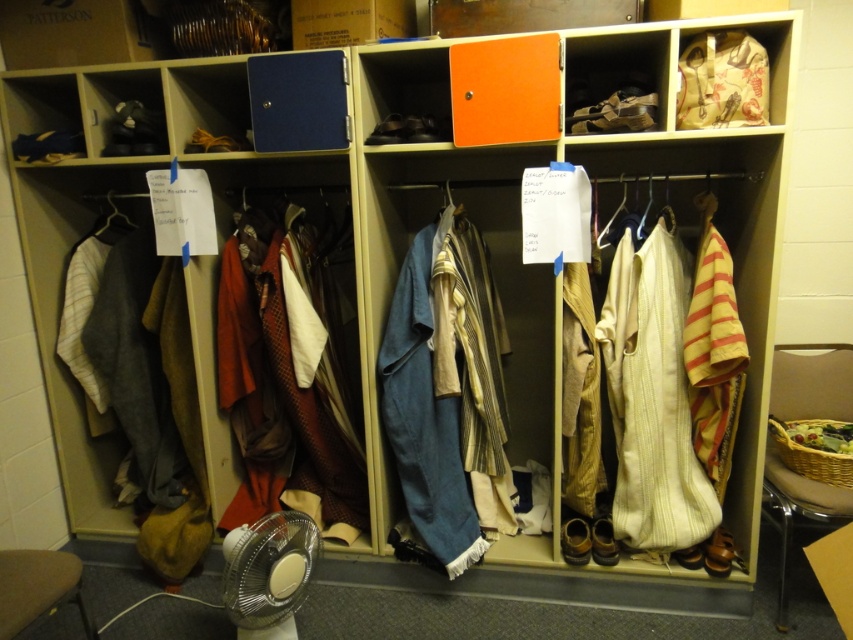
Does textured wool coat at center have a lesser height compared to white plastic fan at lower left?

No.

Measure the distance between point (268, 364) and camera.

2.37 meters

The height and width of the screenshot is (640, 853). I want to click on textured wool coat at center, so click(283, 392).

Does textured wool coat at center lie behind white striped fabric at right?

Yes, it is behind white striped fabric at right.

Identify the location of textured wool coat at center. (283, 392).

In order to click on textured wool coat at center in this screenshot , I will do `click(283, 392)`.

Find the location of a particular element. textured wool coat at center is located at coordinates (283, 392).

Is point (364, 490) in front of point (51, 596)?

No, it is not.

Is textured wool coat at center closer to the viewer compared to wooden stool at lower left?

No, it is not.

The image size is (853, 640). Describe the element at coordinates (283, 392) in the screenshot. I see `textured wool coat at center` at that location.

What are the coordinates of `textured wool coat at center` in the screenshot? It's located at (283, 392).